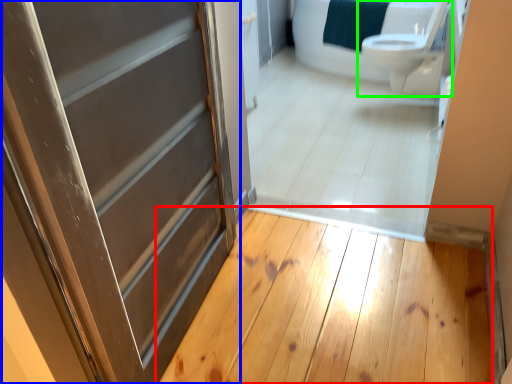
Question: Considering the real-world distances, which object is farthest from plank (highlighted by a red box)? door (highlighted by a blue box) or toilet (highlighted by a green box)?

Choices:
 (A) door
 (B) toilet

Answer: (B)